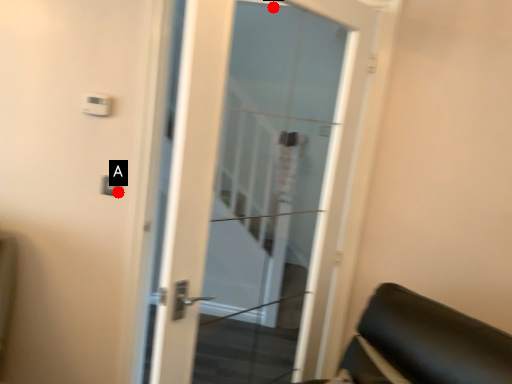
Question: Two points are circled on the image, labeled by A and B beside each circle. Which point is farther from the camera taking this photo?

Choices:
 (A) A is further
 (B) B is further

Answer: (B)